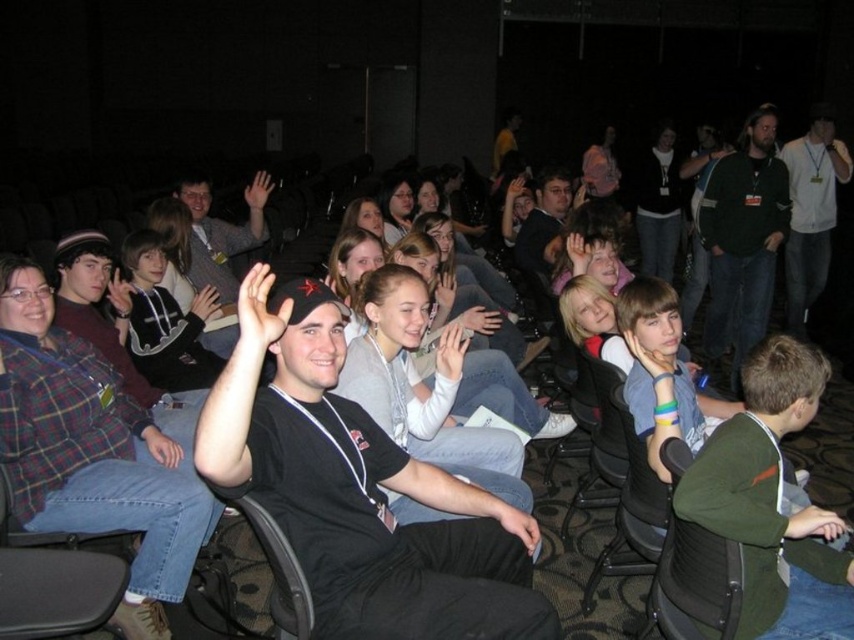
Question: Which of the following is the farthest from the observer?

Choices:
 (A) black mesh chair at lower right
 (B) black plastic chair at lower right
 (C) white t-shirt at right

Answer: (C)

Question: Considering the real-world distances, which object is farthest from the black t-shirt at center?

Choices:
 (A) matte black shirt at center
 (B) black plastic chair at center
 (C) black matte t-shirt at center
 (D) black sweater at upper center

Answer: (D)

Question: Can you confirm if green jersey at center is smaller than dark green sweater at upper right?

Choices:
 (A) yes
 (B) no

Answer: (A)

Question: Is black mesh chair at lower right thinner than white t-shirt at right?

Choices:
 (A) yes
 (B) no

Answer: (A)

Question: Among these points, which one is farthest from the camera?

Choices:
 (A) (774, 202)
 (B) (673, 552)
 (C) (642, 220)
 (D) (773, 404)

Answer: (C)

Question: Can you confirm if white t-shirt at right is wider than matte black shirt at center?

Choices:
 (A) yes
 (B) no

Answer: (A)